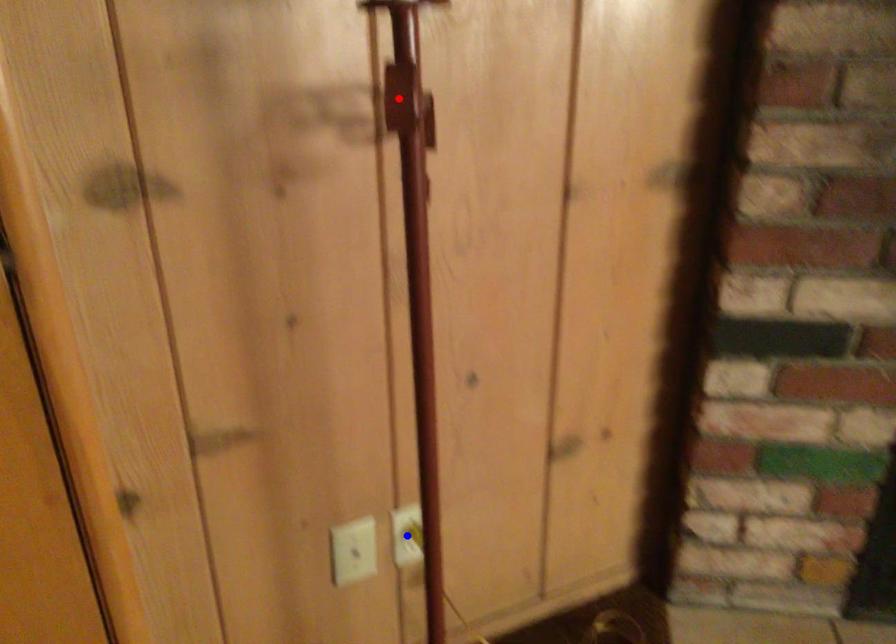
Question: Two points are marked on the image. Which point is closer to the camera?

Choices:
 (A) Blue point is closer.
 (B) Red point is closer.

Answer: (B)